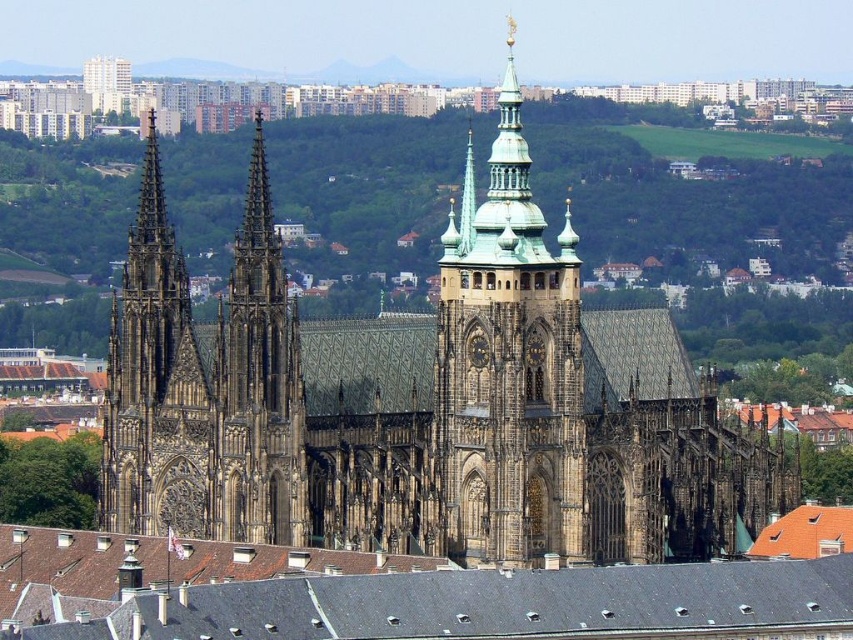
Who is taller, golden stone tower at center or green-golden stone spire at upper center?

With more height is golden stone tower at center.

Which is in front, point (552, 348) or point (471, 220)?

Positioned in front is point (552, 348).

Between point (566, 316) and point (469, 236), which one is positioned behind?

The point (469, 236) is more distant.

Find the location of a particular element. golden stone tower at center is located at coordinates (509, 371).

Between point (573, 250) and point (282, 477), which one is positioned in front?

Point (282, 477) is in front.

Does point (573, 342) come farther from viewer compared to point (213, 476)?

Yes, it is behind point (213, 476).

Where is `golden stone tower at center`? golden stone tower at center is located at coordinates (509, 371).

Which of these two, brown stone church at center or dark brown stone tower at center, stands taller?

Standing taller between the two is brown stone church at center.

Between brown stone church at center and dark brown stone tower at center, which one is positioned higher?

dark brown stone tower at center

You are a GUI agent. You are given a task and a screenshot of the screen. Output one action in this format:
    pyautogui.click(x=<x>, y=<y>)
    Task: Click on the brown stone church at center
    The image size is (853, 640).
    Given the screenshot: What is the action you would take?
    pyautogui.click(x=421, y=403)